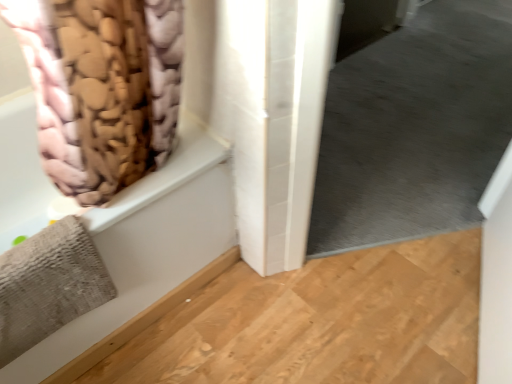
Question: Does beige fabric bath at left have a smaller size compared to gray matte carpet at lower right?

Choices:
 (A) no
 (B) yes

Answer: (A)

Question: Does beige fabric bath at left lie behind gray matte carpet at lower right?

Choices:
 (A) no
 (B) yes

Answer: (A)

Question: From the image's perspective, is beige fabric bath at left below gray matte carpet at lower right?

Choices:
 (A) no
 (B) yes

Answer: (B)

Question: Is beige fabric bath at left directly adjacent to gray matte carpet at lower right?

Choices:
 (A) no
 (B) yes

Answer: (A)

Question: Is gray matte carpet at lower right completely or partially inside beige fabric bath at left?

Choices:
 (A) no
 (B) yes

Answer: (A)

Question: Is gray matte carpet at lower right wider or thinner than beige fabric bath at left?

Choices:
 (A) thin
 (B) wide

Answer: (A)

Question: Visually, is gray matte carpet at lower right positioned to the left or to the right of beige fabric bath at left?

Choices:
 (A) left
 (B) right

Answer: (B)

Question: From their relative heights in the image, would you say gray matte carpet at lower right is taller or shorter than beige fabric bath at left?

Choices:
 (A) tall
 (B) short

Answer: (A)

Question: Is point 348,127 closer or farther from the camera than point 4,109?

Choices:
 (A) closer
 (B) farther

Answer: (B)

Question: Relative to beige fabric bath at left, is pink fabric curtain at upper left in front or behind?

Choices:
 (A) behind
 (B) front

Answer: (B)

Question: From their relative heights in the image, would you say pink fabric curtain at upper left is taller or shorter than beige fabric bath at left?

Choices:
 (A) tall
 (B) short

Answer: (A)

Question: In the image, is pink fabric curtain at upper left on the left side or the right side of beige fabric bath at left?

Choices:
 (A) left
 (B) right

Answer: (B)

Question: In terms of width, does pink fabric curtain at upper left look wider or thinner when compared to beige fabric bath at left?

Choices:
 (A) wide
 (B) thin

Answer: (B)

Question: From the image's perspective, relative to gray matte carpet at lower right, is pink fabric curtain at upper left above or below?

Choices:
 (A) below
 (B) above

Answer: (B)

Question: Looking at their shapes, would you say pink fabric curtain at upper left is wider or thinner than gray matte carpet at lower right?

Choices:
 (A) thin
 (B) wide

Answer: (B)